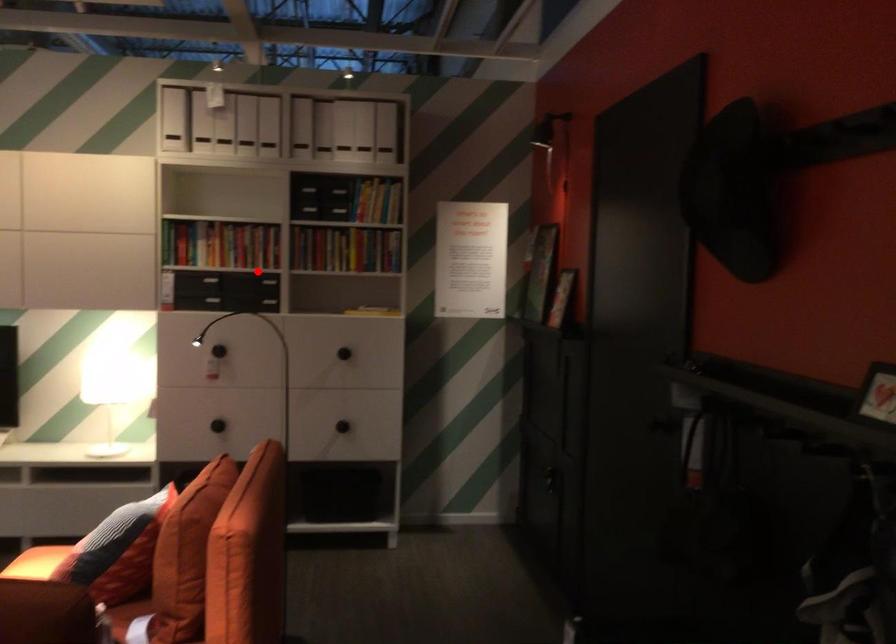
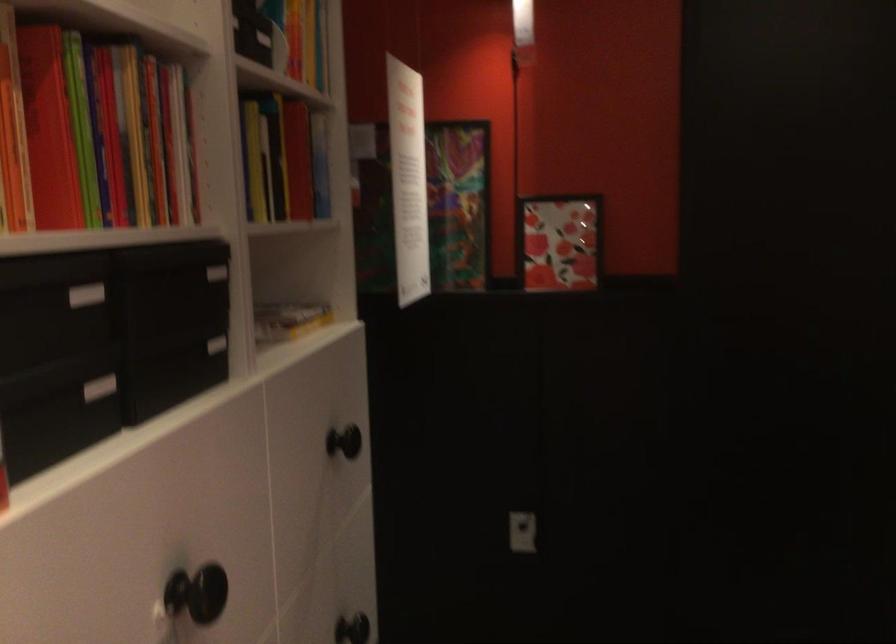
Question: A red point is marked in image1. In image2, is the corresponding 3D point closer to the camera or farther? Reply with the corresponding letter.

Choices:
 (A) The corresponding 3D point is closer.
 (B) The corresponding 3D point is farther.

Answer: (A)